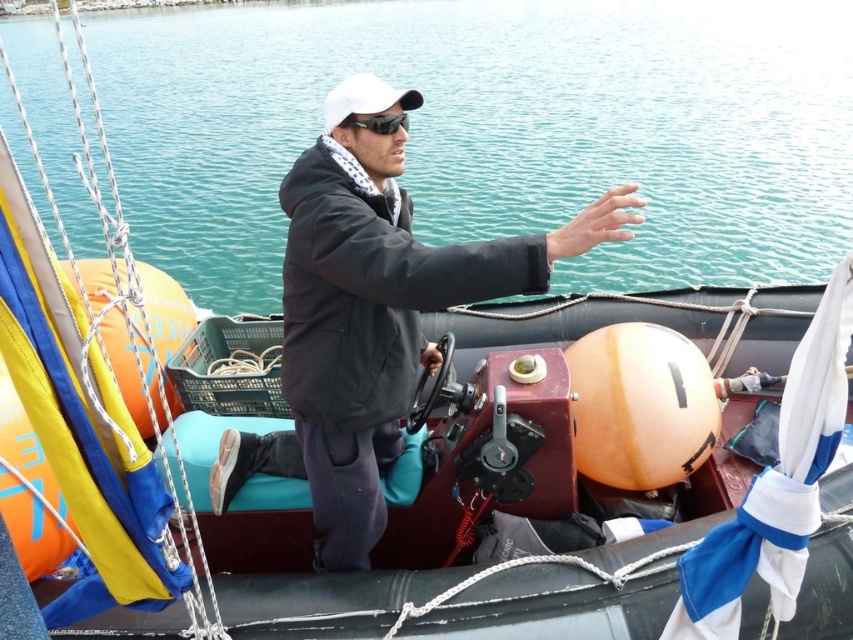
Is black matte jacket at center smaller than white matte baseball cap at center?

Yes.

Measure the distance between black matte jacket at center and camera.

A distance of 2.15 meters exists between black matte jacket at center and camera.

You are a GUI agent. You are given a task and a screenshot of the screen. Output one action in this format:
    pyautogui.click(x=<x>, y=<y>)
    Task: Click on the black matte jacket at center
    The width and height of the screenshot is (853, 640).
    Given the screenshot: What is the action you would take?
    tap(373, 326)

Is turquoise water at center above white matte baseball cap at center?

Yes, turquoise water at center is above white matte baseball cap at center.

In the scene shown: Is turquoise water at center positioned at the back of white matte baseball cap at center?

No, it is in front of white matte baseball cap at center.

The image size is (853, 640). I want to click on turquoise water at center, so click(x=494, y=131).

Who is taller, black matte jacket at center or black matte sunglasses at upper center?

black matte jacket at center is taller.

Which is behind, point (370, 188) or point (389, 129)?

The point (370, 188) is behind.

Who is more forward, [329,396] or [370,131]?

Point [370,131]

I want to click on black matte jacket at center, so click(373, 326).